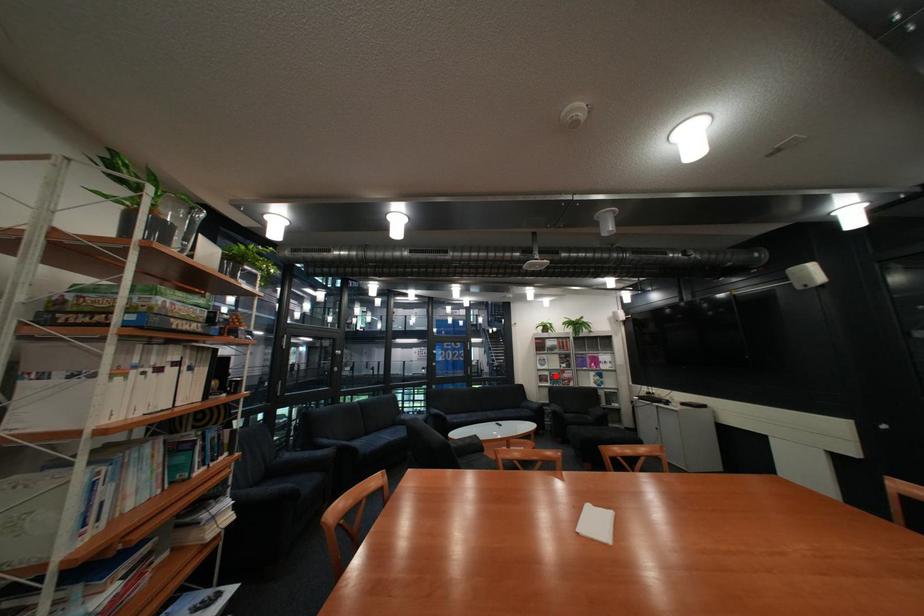
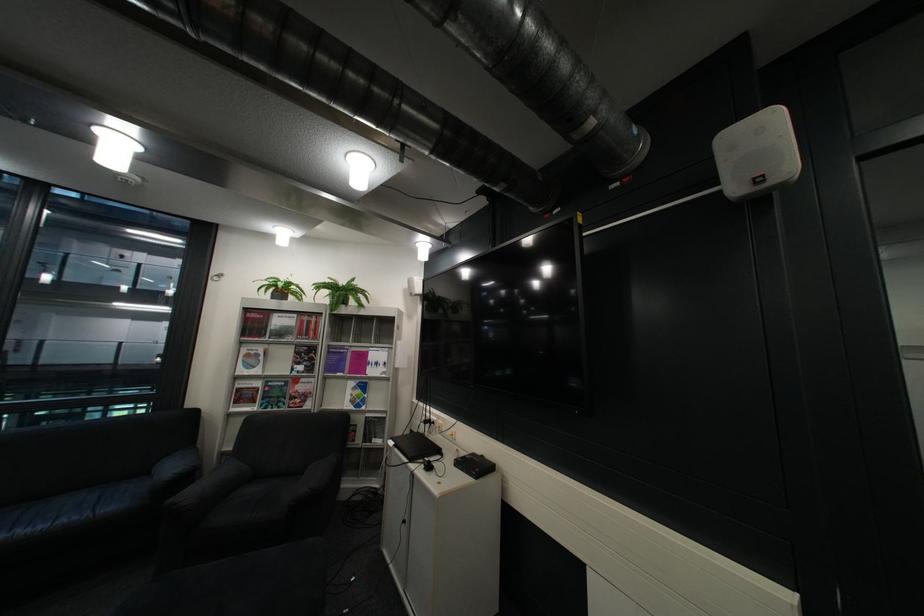
Question: I am providing you with two images of the same scene from different viewpoints. Image1 has a red point marked. In image2, the corresponding 3D location appears at what relative position? Reply with the corresponding letter.

Choices:
 (A) Closer
 (B) Farther

Answer: (A)